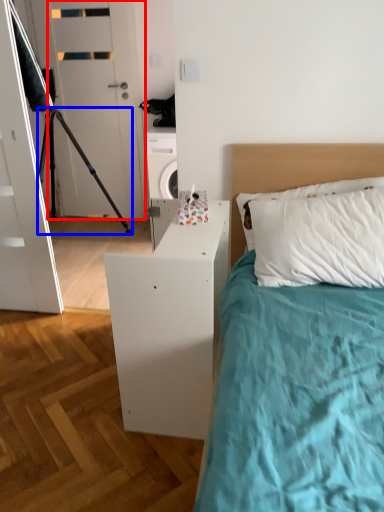
Question: Which point is further to the camera, door (highlighted by a red box) or tripod (highlighted by a blue box)?

Choices:
 (A) door
 (B) tripod

Answer: (A)